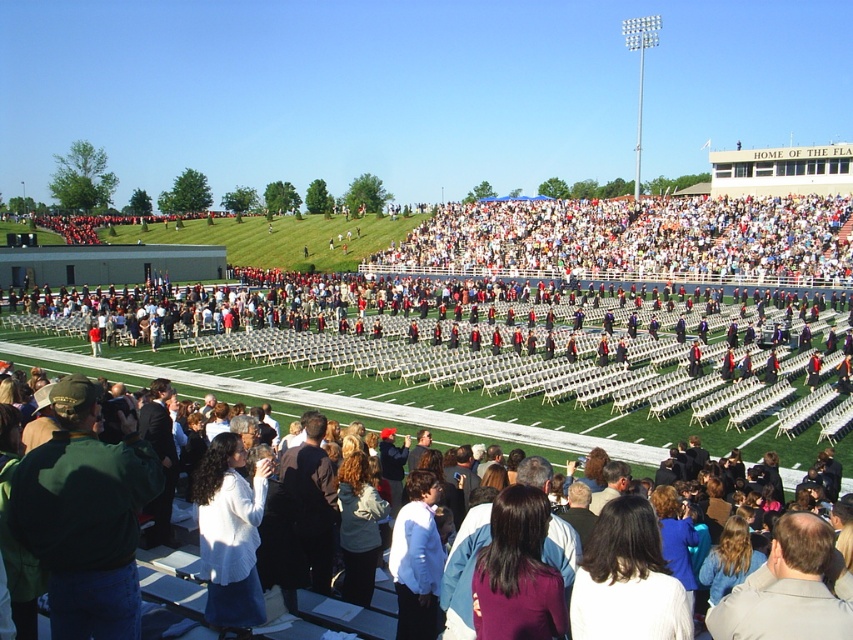
Is point (689, 252) farther from camera compared to point (218, 488)?

Yes, point (689, 252) is behind point (218, 488).

Does point (480, 205) lie behind point (244, 451)?

Yes.

Where is `white plastic chairs at upper center`? Image resolution: width=853 pixels, height=640 pixels. white plastic chairs at upper center is located at coordinates (635, 241).